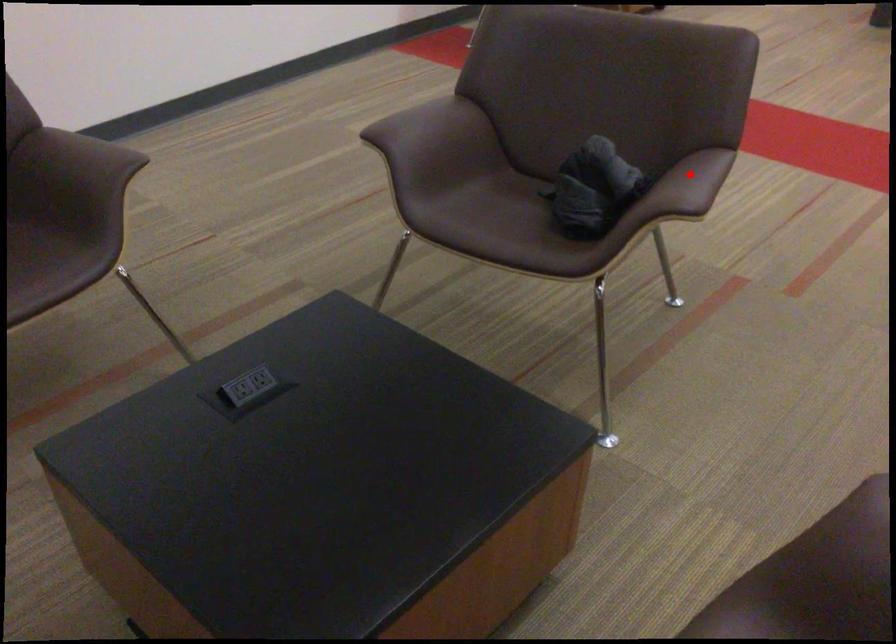
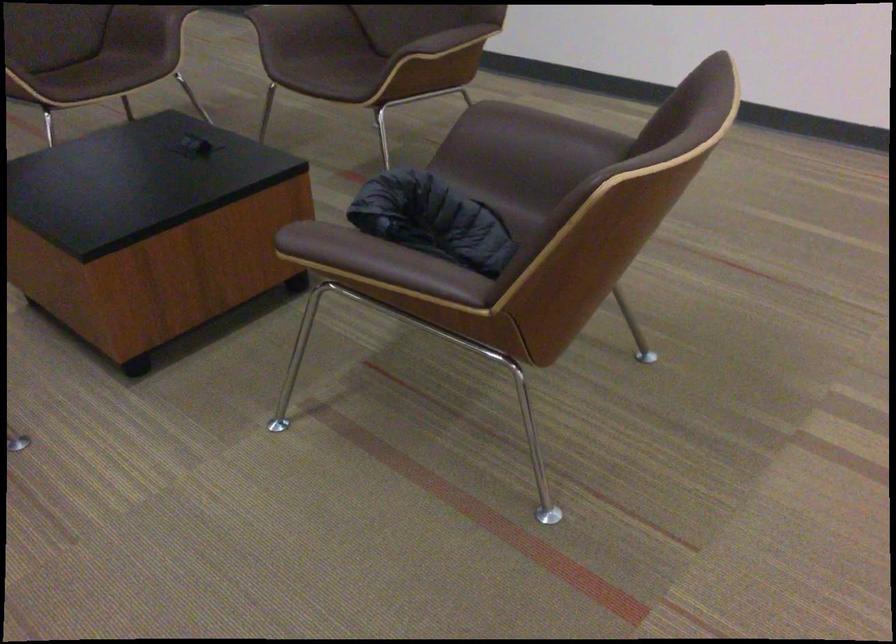
Question: I am providing you with two images of the same scene from different viewpoints. In image1, a red point is highlighted. Considering the same 3D point in image2, which of the following is correct?

Choices:
 (A) It is closer
 (B) It is farther

Answer: (A)